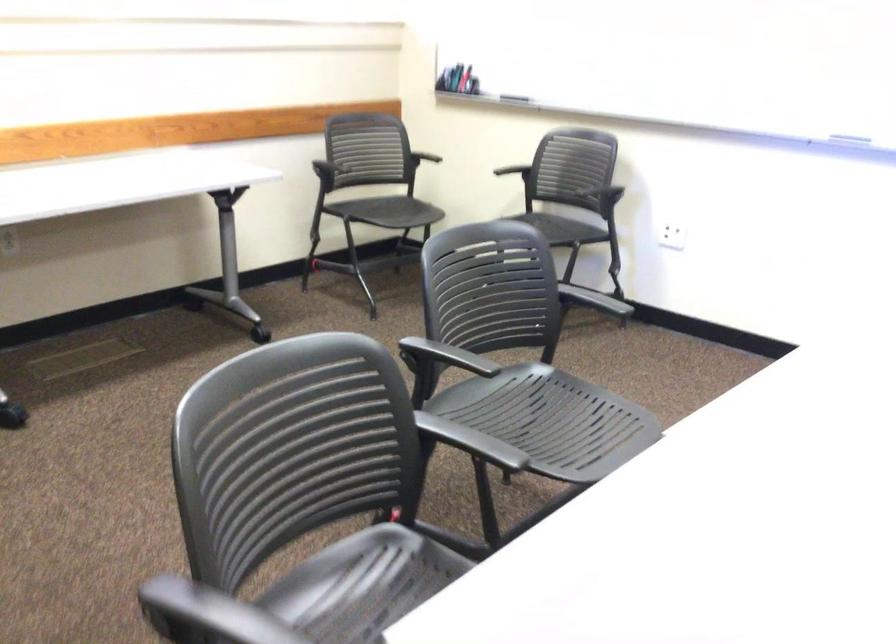
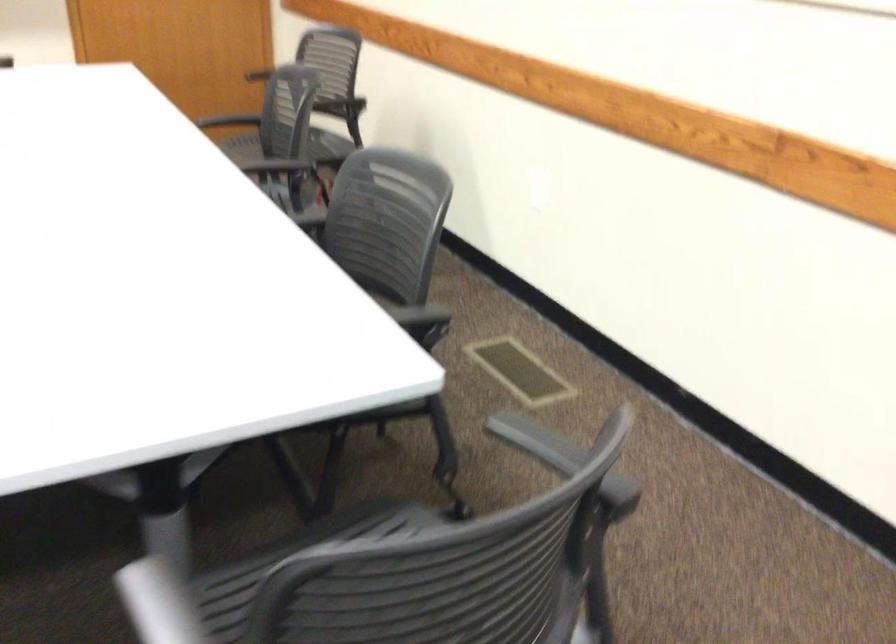
Locate, in the second image, the point that corresponds to point (392, 361) in the first image.

(293, 560)